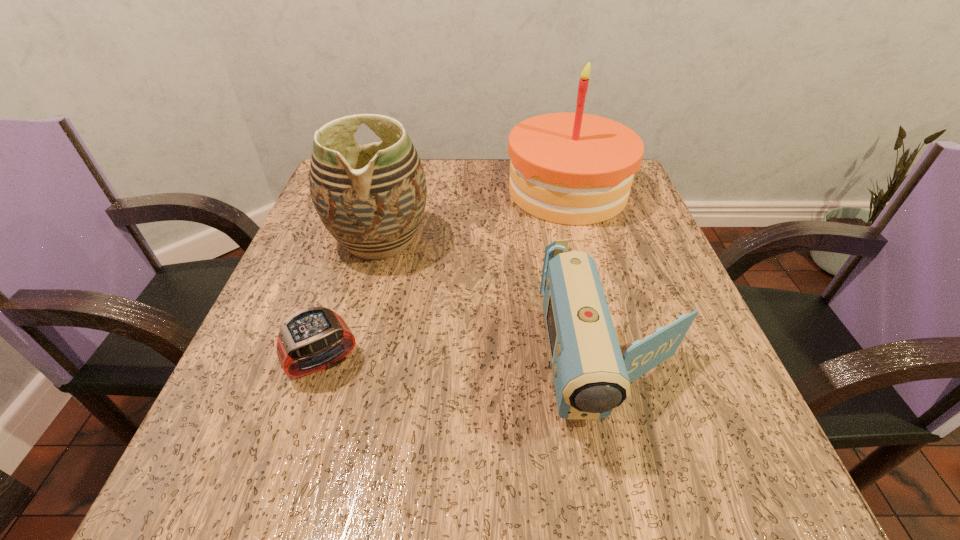
Identify the location of vacant space at the right edge. The height and width of the screenshot is (540, 960). (618, 286).

Locate an element on the screen. This screenshot has width=960, height=540. vacant space at the near left corner of the desktop is located at coordinates (238, 487).

Locate an element on the screen. The image size is (960, 540). vacant area that lies between the shortest object and the tallest object is located at coordinates (445, 276).

This screenshot has width=960, height=540. I want to click on vacant region between the shortest object and the camcorder, so click(x=468, y=364).

The width and height of the screenshot is (960, 540). In order to click on free spot between the tallest object and the watch in this screenshot , I will do `click(445, 276)`.

This screenshot has width=960, height=540. What are the coordinates of `free point between the birthday cake and the pottery` in the screenshot? It's located at (473, 215).

At what (x,y) coordinates should I click in order to perform the action: click on blank region between the birthday cake and the pottery. Please return your answer as a coordinate pair (x, y). Looking at the image, I should click on (473, 215).

The image size is (960, 540). Find the location of `unoccupied position between the watch and the third tallest object`. unoccupied position between the watch and the third tallest object is located at coordinates (468, 364).

Identify the location of free spot between the third tallest object and the pottery. (497, 302).

This screenshot has width=960, height=540. I want to click on free space between the birthday cake and the pottery, so click(x=473, y=215).